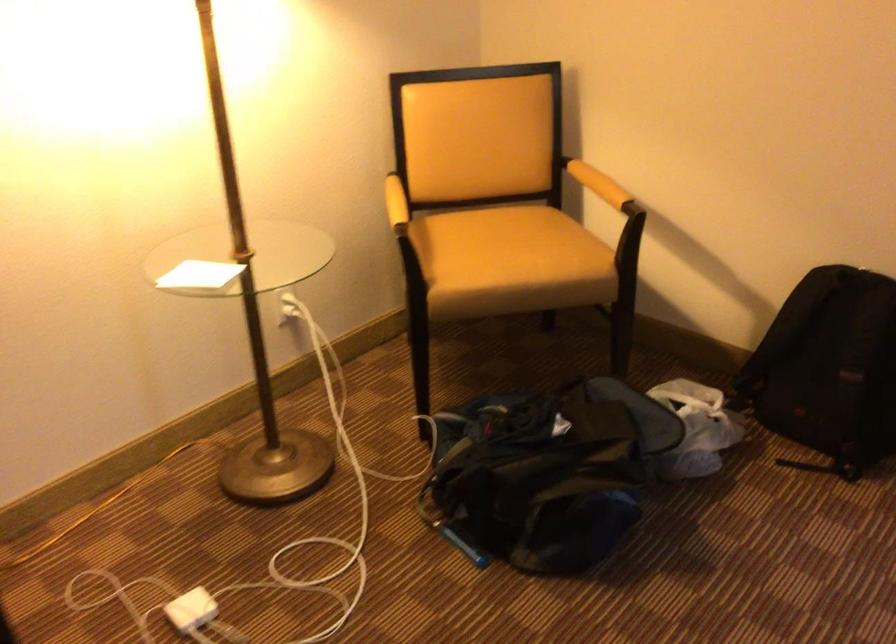
The width and height of the screenshot is (896, 644). Describe the element at coordinates (510, 261) in the screenshot. I see `a chair sitting surface` at that location.